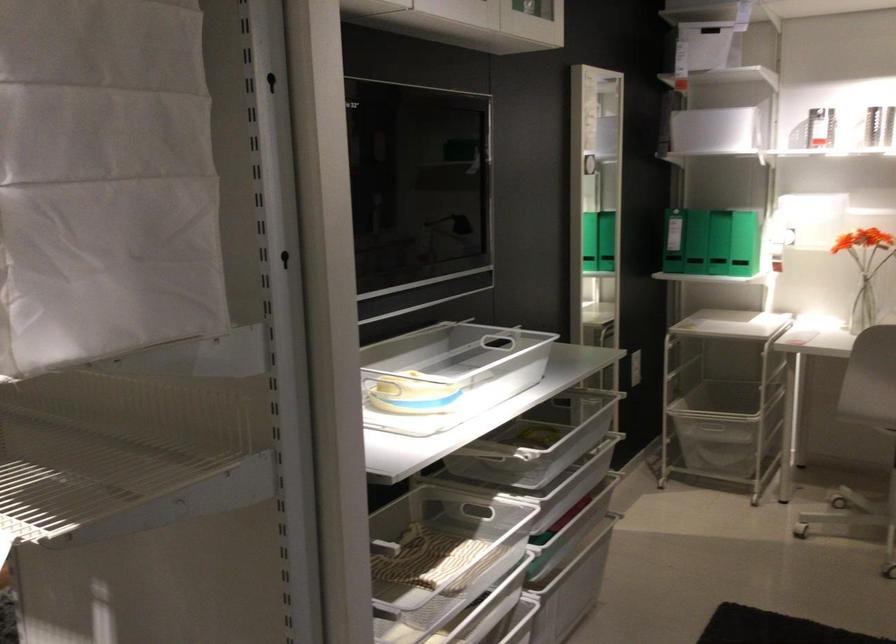
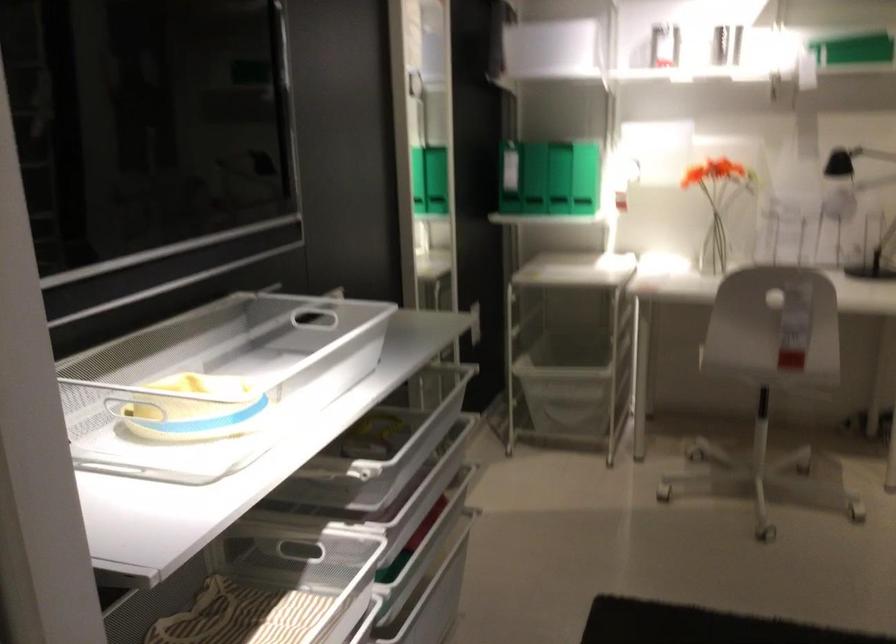
Find the pixel in the second image that matches (x=412, y=383) in the first image.

(216, 383)